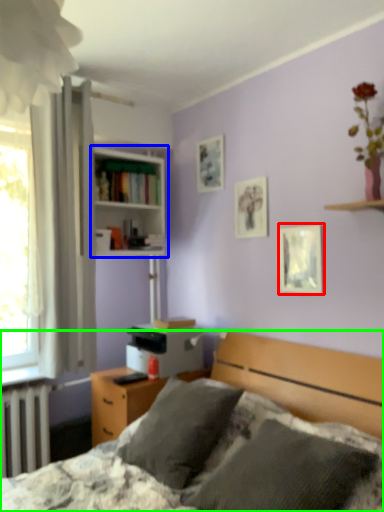
Question: Considering the real-world distances, which object is farthest from picture frame (highlighted by a red box)? bookcase (highlighted by a blue box) or bed (highlighted by a green box)?

Choices:
 (A) bookcase
 (B) bed

Answer: (A)